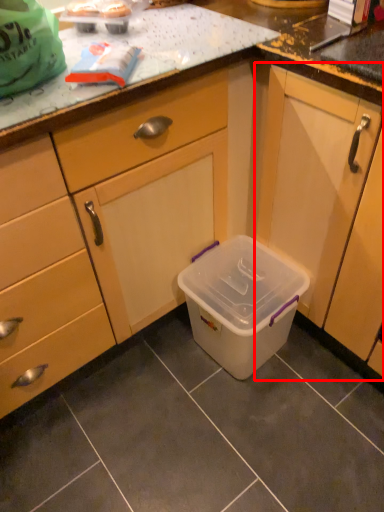
Question: Where is cabinetry (annotated by the red box) located in relation to storage box in the image?

Choices:
 (A) left
 (B) right

Answer: (B)